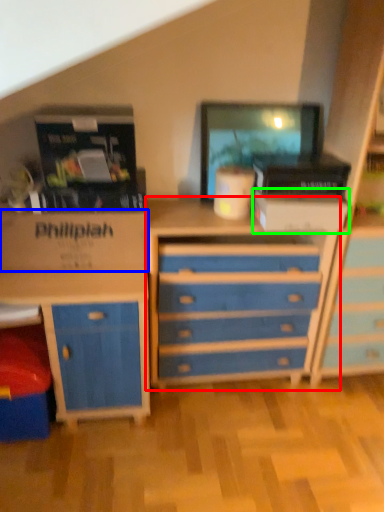
Question: Based on their relative distances, which object is nearer to chest of drawers (highlighted by a red box)? Choose from cardboard box (highlighted by a blue box) and storage box (highlighted by a green box).

Choices:
 (A) cardboard box
 (B) storage box

Answer: (B)